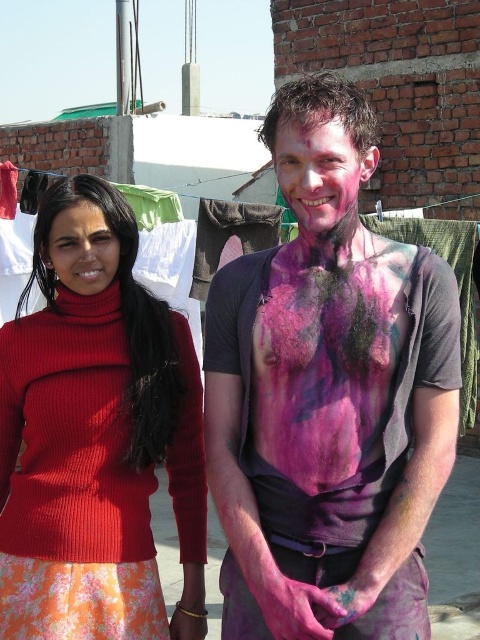
Looking at this image, measure the distance between painted skin body at center and camera.

painted skin body at center and camera are 4.37 meters apart.

Is painted skin body at center to the right of matte red sweater at left from the viewer's perspective?

Yes, painted skin body at center is to the right of matte red sweater at left.

Where is `painted skin body at center`? The image size is (480, 640). painted skin body at center is located at coordinates (327, 396).

Where is `painted skin body at center`? The width and height of the screenshot is (480, 640). painted skin body at center is located at coordinates (327, 396).

Is pink matte face at center shorter than matte red sweater at left?

No.

Between point (294, 186) and point (76, 276), which one is positioned behind?

Point (76, 276)

Image resolution: width=480 pixels, height=640 pixels. I want to click on pink matte face at center, so click(x=317, y=170).

Can you confirm if knitted red sweater at left is smaller than pink matte face at center?

Incorrect, knitted red sweater at left is not smaller in size than pink matte face at center.

Does knitted red sweater at left appear over pink matte face at center?

Actually, knitted red sweater at left is below pink matte face at center.

Between point (16, 508) and point (365, 176), which one is positioned in front?

Point (365, 176) is in front.

Find the location of a particular element. The width and height of the screenshot is (480, 640). knitted red sweater at left is located at coordinates (96, 428).